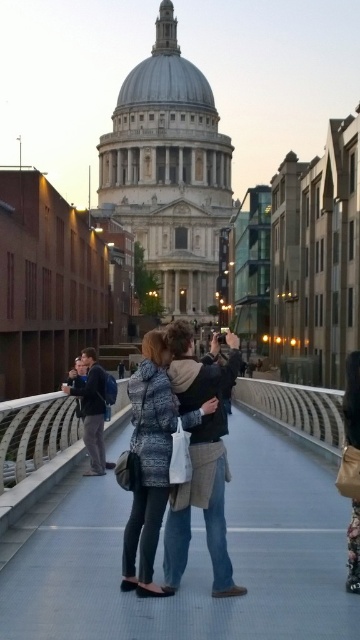
Question: Among these points, which one is nearest to the camera?

Choices:
 (A) (203, 376)
 (B) (102, 460)

Answer: (A)

Question: Is smooth concrete bridge at center thinner than dark blue jacket at center?

Choices:
 (A) no
 (B) yes

Answer: (A)

Question: Can you confirm if denim jacket at center is thinner than dark blue jacket at center?

Choices:
 (A) yes
 (B) no

Answer: (B)

Question: Considering the relative positions of smooth concrete bridge at center and dark blue jacket at center in the image provided, where is smooth concrete bridge at center located with respect to dark blue jacket at center?

Choices:
 (A) left
 (B) right

Answer: (B)

Question: Which of the following is the farthest from the observer?

Choices:
 (A) dark blue jacket at center
 (B) denim jacket at center
 (C) smooth concrete bridge at center

Answer: (A)

Question: Which object is positioned farthest from the dark blue jacket at center?

Choices:
 (A) denim jacket at center
 (B) smooth concrete bridge at center

Answer: (A)